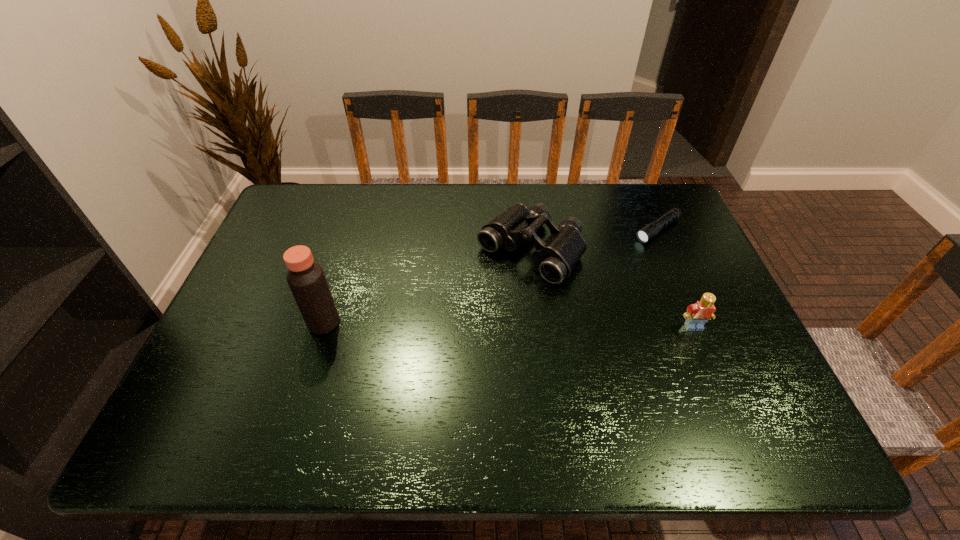
I want to click on vacant area situated 0.200m on the front-facing side of the third object from right to left, so click(453, 327).

Where is `blank space located on the front-facing side of the third object from right to left`? blank space located on the front-facing side of the third object from right to left is located at coordinates (461, 320).

Locate an element on the screen. Image resolution: width=960 pixels, height=540 pixels. vacant space situated 0.130m on the front-facing side of the third object from right to left is located at coordinates [470, 310].

Locate an element on the screen. The height and width of the screenshot is (540, 960). flashlight that is at the far edge is located at coordinates (648, 232).

I want to click on binoculars that is at the far edge, so click(556, 257).

This screenshot has height=540, width=960. Find the location of `Lego that is positioned at the right edge`. Lego that is positioned at the right edge is located at coordinates (697, 314).

Identify the location of flashlight that is at the right edge. The height and width of the screenshot is (540, 960). (648, 232).

You are a GUI agent. You are given a task and a screenshot of the screen. Output one action in this format:
    pyautogui.click(x=<x>, y=<y>)
    Task: Click on the object positioned at the far right corner
    The height and width of the screenshot is (540, 960).
    Given the screenshot: What is the action you would take?
    pyautogui.click(x=648, y=232)

At what (x,y) coordinates should I click in order to perform the action: click on vacant space at the far edge of the desktop. Please return your answer as a coordinate pair (x, y). The width and height of the screenshot is (960, 540). Looking at the image, I should click on (510, 197).

Locate an element on the screen. blank space at the near edge of the desktop is located at coordinates (563, 389).